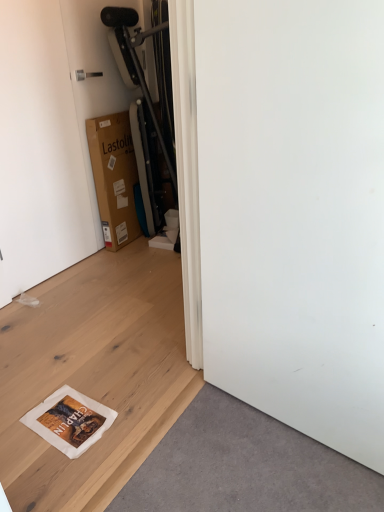
Locate an element on the screen. This screenshot has height=512, width=384. free spot above white matte plywood at lower left (from a real-world perspective) is located at coordinates (96, 315).